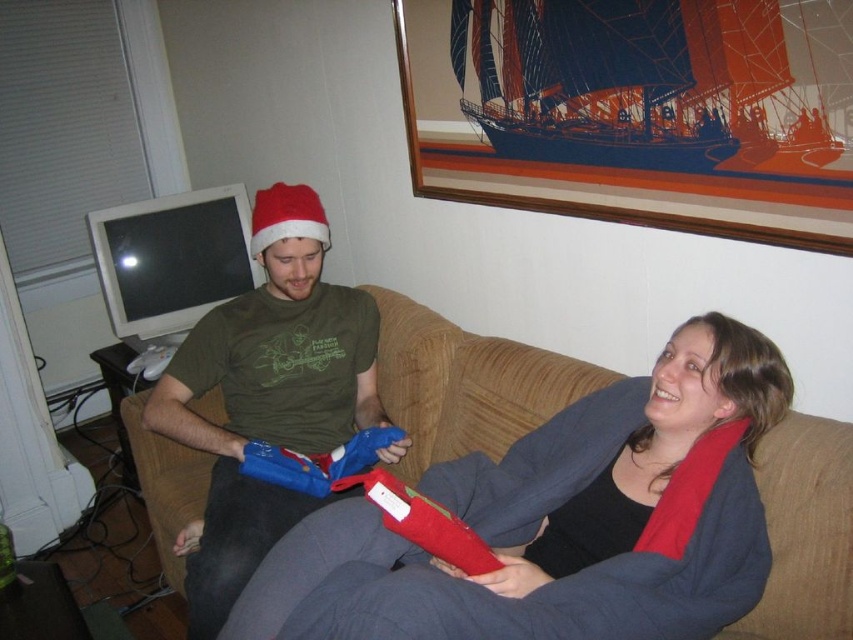
You are standing in the living room and want to hang a new picture frame exactly where the wooden picture frame at upper right is currently located. What are the coordinates of the spot where you should place your new frame?

The wooden picture frame at upper right is located at coordinates point (634, 112), so you should place your new frame at those coordinates.